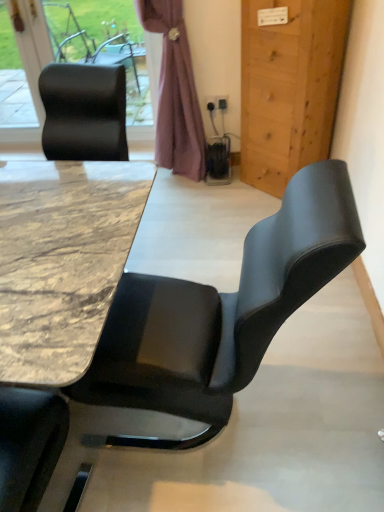
Where is `marble/black at center`? marble/black at center is located at coordinates (62, 261).

In order to face matte black chair at center, should I rotate leftwards or rightwards?

To align with it, rotate left about 0.341°.

What is the approximate height of black leather chair at upper left?

black leather chair at upper left is 39.08 inches tall.

Measure the distance between point (159, 17) and camera.

They are 7.90 feet apart.

This screenshot has width=384, height=512. What are the coordinates of `marble/black at center` in the screenshot? It's located at (62, 261).

Is purple fabric curtain at upper center far from matte black chair at center?

Yes.

Does purple fabric curtain at upper center have a larger size compared to matte black chair at center?

Incorrect, purple fabric curtain at upper center is not larger than matte black chair at center.

Could you tell me if purple fabric curtain at upper center is facing matte black chair at center?

Yes, purple fabric curtain at upper center is facing matte black chair at center.

Which object is closer to the camera taking this photo, purple fabric curtain at upper center or matte black chair at center?

matte black chair at center.

Measure the distance between matte black chair at center and black leather chair at upper left.

The distance of matte black chair at center from black leather chair at upper left is 2.28 meters.

Considering the relative sizes of matte black chair at center and black leather chair at upper left in the image provided, is matte black chair at center taller than black leather chair at upper left?

Yes, matte black chair at center is taller than black leather chair at upper left.

Is point (324, 196) positioned after point (145, 38)?

No, it is in front of (145, 38).

Consider the image. Which of these two, matte black chair at center or black leather chair at upper left, is wider?

With larger width is matte black chair at center.

Looking at this image, how many degrees apart are the facing directions of matte black chair at center and purple fabric curtain at upper center?

The facing directions of matte black chair at center and purple fabric curtain at upper center are 99.6 degrees apart.

The height and width of the screenshot is (512, 384). I want to click on chair directly beneath the purple fabric curtain at upper center (from a real-world perspective), so click(x=221, y=312).

Which object is wider, matte black chair at center or purple fabric curtain at upper center?

matte black chair at center.

From the image's perspective, is matte black chair at center on purple fabric curtain at upper center?

No.

Is black leather chair at upper left in contact with marble/black at center?

There is a gap between black leather chair at upper left and marble/black at center.

Between black leather chair at upper left and marble/black at center, which one has more height?

black leather chair at upper left is taller.

Is black leather chair at upper left facing away from marble/black at center?

No, marble/black at center is not at the back of black leather chair at upper left.

Is black leather chair at upper left to the left of marble/black at center from the viewer's perspective?

Correct, you'll find black leather chair at upper left to the left of marble/black at center.

How many degrees apart are the facing directions of marble/black at center and wooden door at right?

There is a 132-degree angle between the facing directions of marble/black at center and wooden door at right.

Visually, is marble/black at center positioned to the left or to the right of wooden door at right?

Based on their positions, marble/black at center is located to the left of wooden door at right.

Considering the sizes of objects marble/black at center and wooden door at right in the image provided, who is wider, marble/black at center or wooden door at right?

With larger width is marble/black at center.

Is point (143, 178) in front of point (260, 181)?

Yes.

How many degrees apart are the facing directions of marble/black at center and black leather chair at upper left?

The facing directions of marble/black at center and black leather chair at upper left are 88.3 degrees apart.

Is marble/black at center taller or shorter than black leather chair at upper left?

In the image, marble/black at center appears to be shorter than black leather chair at upper left.

Considering the positions of point (51, 370) and point (22, 62), is point (51, 370) closer or farther from the camera than point (22, 62)?

Point (51, 370) appears to be closer to the viewer than point (22, 62).

Is marble/black at center to the left or to the right of black leather chair at upper left in the image?

From the image, it's evident that marble/black at center is to the right of black leather chair at upper left.

From the image's perspective, which is above, purple fabric curtain at upper center or black leather chair at upper left?

black leather chair at upper left is shown above in the image.

This screenshot has height=512, width=384. I want to click on curtain that appears on the right of black leather chair at upper left, so pyautogui.click(x=175, y=92).

Based on the photo, from a real-world perspective, does purple fabric curtain at upper center stand above black leather chair at upper left?

No.

Considering the relative sizes of purple fabric curtain at upper center and black leather chair at upper left in the image provided, is purple fabric curtain at upper center shorter than black leather chair at upper left?

No, purple fabric curtain at upper center is not shorter than black leather chair at upper left.

At what (x,y) coordinates should I click in order to perform the action: click on chair that is under the purple fabric curtain at upper center (from a real-world perspective). Please return your answer as a coordinate pair (x, y). The width and height of the screenshot is (384, 512). Looking at the image, I should click on (221, 312).

The width and height of the screenshot is (384, 512). What are the coordinates of `window behind the matte black chair at center` in the screenshot? It's located at (34, 50).

Estimate the real-world distances between objects in this image. Which object is further from marble/black at center, purple fabric curtain at upper center or wooden door at right?

Based on the image, purple fabric curtain at upper center appears to be further to marble/black at center.

Which object lies nearer to the anchor point marble/black at center, wooden door at right or matte black chair at center?

Based on the image, matte black chair at center appears to be nearer to marble/black at center.

Considering their positions, is marble/black at center positioned closer to wooden door at right than black leather chair at upper left?

Based on the image, marble/black at center appears to be nearer to wooden door at right.

Based on the photo, based on their spatial positions, is wooden door at right or black leather chair at upper left further from purple fabric curtain at upper center?

black leather chair at upper left lies further to purple fabric curtain at upper center than the other object.

Considering their positions, is purple fabric curtain at upper center positioned closer to wooden door at right than black leather chair at upper left?

Based on the image, purple fabric curtain at upper center appears to be nearer to wooden door at right.

Considering their positions, is marble/black at center positioned further to black leather chair at upper left than purple fabric curtain at upper center?

marble/black at center is positioned further to the anchor black leather chair at upper left.

When comparing their distances from wooden door at right, does purple fabric curtain at upper center or matte black chair at center seem closer?

purple fabric curtain at upper center.

Considering their positions, is marble/black at center positioned further to wooden door at right than matte black chair at center?

The object further to wooden door at right is matte black chair at center.

Image resolution: width=384 pixels, height=512 pixels. I want to click on door between marble/black at center and purple fabric curtain at upper center along the z-axis, so click(x=289, y=87).

Locate an element on the screen. Image resolution: width=384 pixels, height=512 pixels. curtain between black leather chair at upper left and wooden door at right is located at coordinates (175, 92).

This screenshot has width=384, height=512. Identify the location of curtain located between matte black chair at center and black leather chair at upper left in the depth direction. (175, 92).

Locate an element on the screen. Image resolution: width=384 pixels, height=512 pixels. table located between matte black chair at center and purple fabric curtain at upper center in the depth direction is located at coordinates (62, 261).